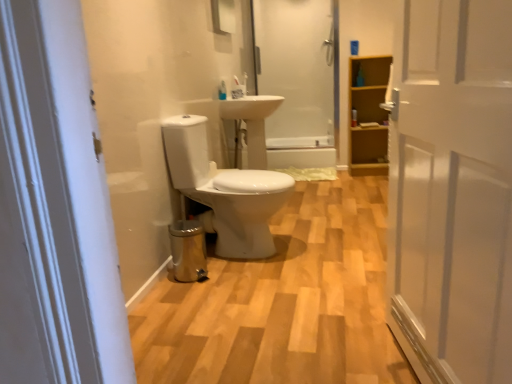
Question: From the image's perspective, relative to translucent plastic toothbrush at center, the 2th toiletry positioned from the right, is glossy glass mirror at upper center above or below?

Choices:
 (A) below
 (B) above

Answer: (B)

Question: Considering the positions of glossy glass mirror at upper center and translucent plastic toothbrush at center, the first toiletry positioned from the left, in the image, is glossy glass mirror at upper center wider or thinner than translucent plastic toothbrush at center, the first toiletry positioned from the left,?

Choices:
 (A) thin
 (B) wide

Answer: (B)

Question: Which object is the farthest from the translucent plastic toothbrush at center, which is the second toiletry from back to front?

Choices:
 (A) light brown wood cabinet at right
 (B) translucent plastic bottle at upper right, marked as the second toiletry in a left-to-right arrangement
 (C) white wooden door at right
 (D) white glossy toilet at center
 (E) translucent glass shower door at upper center

Answer: (C)

Question: Which object is the closest to the light brown wood cabinet at right?

Choices:
 (A) translucent plastic toothbrush at center, the 2th toiletry positioned from the right
 (B) translucent plastic bottle at upper right, which is the 1th toiletry in right-to-left order
 (C) translucent glass shower door at upper center
 (D) glossy glass mirror at upper center
 (E) white glossy sink at center

Answer: (B)